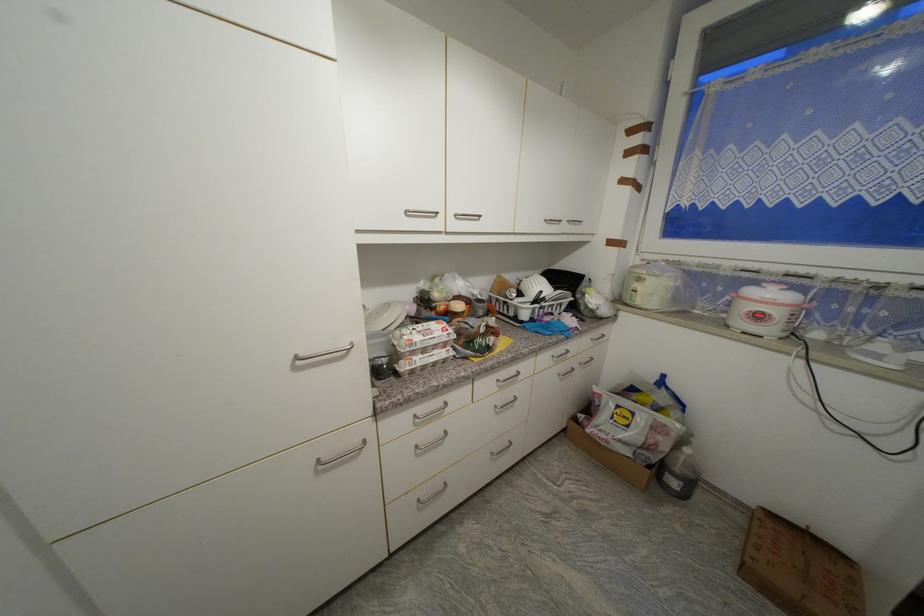
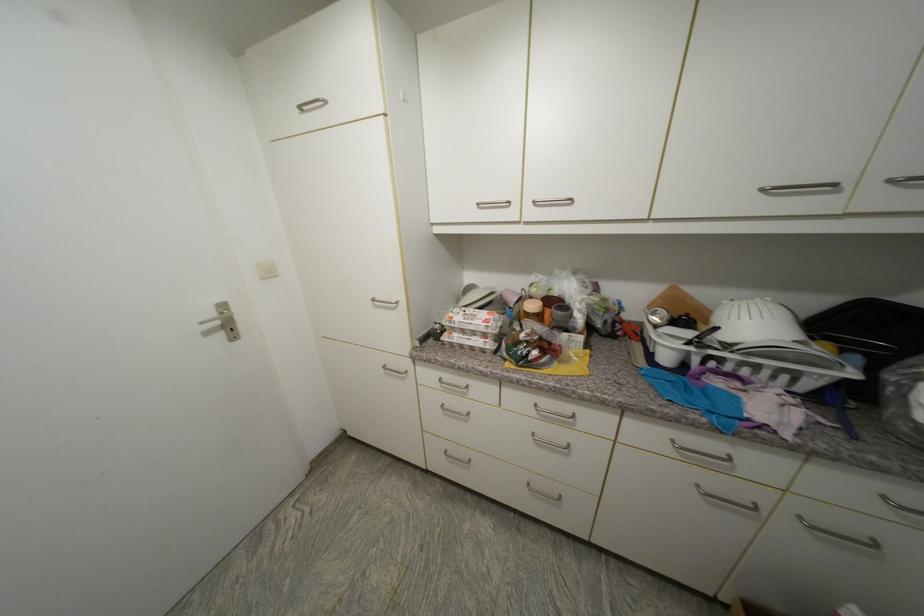
Locate, in the second image, the point that corresponds to point (552, 222) in the first image.

(768, 191)